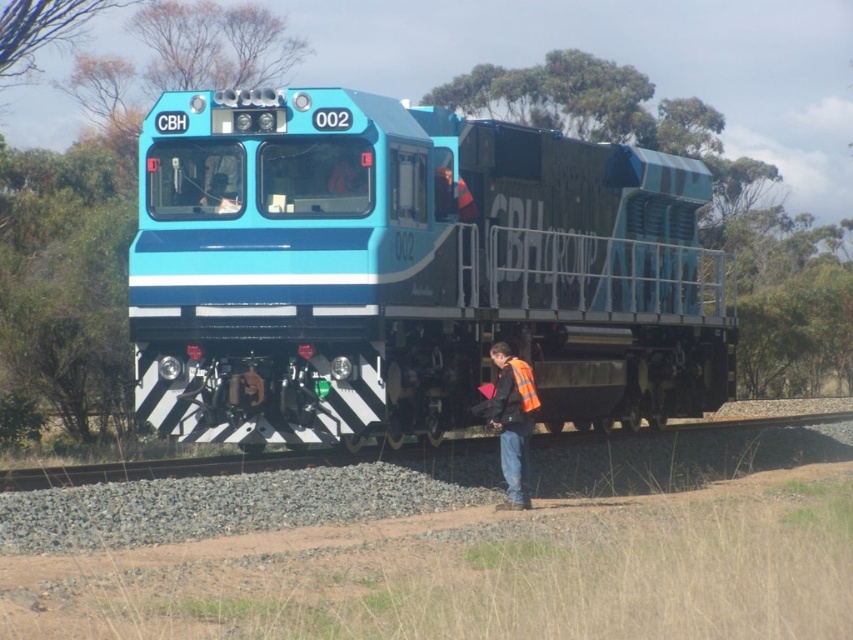
Does blue glossy locomotive at center have a smaller size compared to orange reflective vest at lower center?

Actually, blue glossy locomotive at center might be larger than orange reflective vest at lower center.

Locate an element on the screen. blue glossy locomotive at center is located at coordinates (409, 269).

Identify the location of blue glossy locomotive at center. Image resolution: width=853 pixels, height=640 pixels. (409, 269).

Consider the image. Is blue glossy locomotive at center thinner than black asphalt train track at lower center?

Yes.

Consider the image. Can you confirm if blue glossy locomotive at center is positioned to the right of black asphalt train track at lower center?

Incorrect, blue glossy locomotive at center is not on the right side of black asphalt train track at lower center.

Which is in front, point (459, 136) or point (184, 458)?

Point (459, 136) is more forward.

Find the location of a particular element. blue glossy locomotive at center is located at coordinates (409, 269).

Is black asphalt train track at lower center shorter than orange reflective vest at lower center?

Yes, black asphalt train track at lower center is shorter than orange reflective vest at lower center.

Is black asphalt train track at lower center wider than orange reflective vest at lower center?

Yes, black asphalt train track at lower center is wider than orange reflective vest at lower center.

Is point (467, 442) closer to camera compared to point (502, 454)?

No, (467, 442) is further to viewer.

Identify the location of black asphalt train track at lower center. (169, 468).